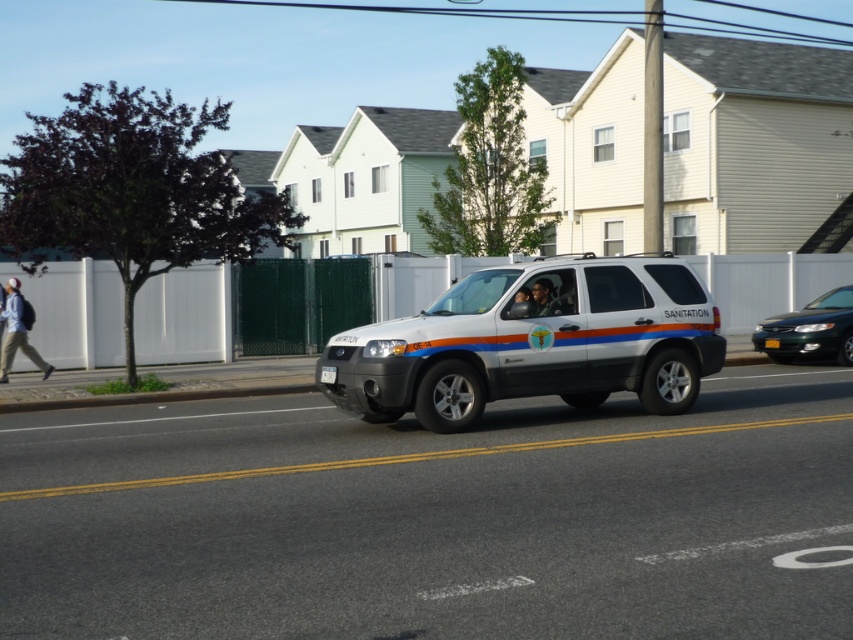
Which is more to the left, metallic green sedan at center or light blue jeans at left?

Positioned to the left is light blue jeans at left.

Can you confirm if metallic green sedan at center is taller than light blue jeans at left?

In fact, metallic green sedan at center may be shorter than light blue jeans at left.

Who is more forward, (846,349) or (47,369)?

Positioned in front is point (47,369).

Find the location of a particular element. This screenshot has width=853, height=640. metallic green sedan at center is located at coordinates click(x=810, y=330).

Image resolution: width=853 pixels, height=640 pixels. Describe the element at coordinates (532, 342) in the screenshot. I see `white matte suv at center` at that location.

Is white matte suv at center to the left of light blue jeans at left from the viewer's perspective?

In fact, white matte suv at center is to the right of light blue jeans at left.

Is point (584, 353) positioned after point (12, 301)?

No, (584, 353) is in front of (12, 301).

The width and height of the screenshot is (853, 640). I want to click on white matte suv at center, so click(x=532, y=342).

Is white matte suv at center taller than metallic green sedan at center?

Correct, white matte suv at center is much taller as metallic green sedan at center.

Who is shorter, white matte suv at center or metallic green sedan at center?

metallic green sedan at center is shorter.

Is point (671, 353) farther from camera compared to point (825, 321)?

No, (671, 353) is in front of (825, 321).

Where is `white matte suv at center`? The width and height of the screenshot is (853, 640). white matte suv at center is located at coordinates (532, 342).